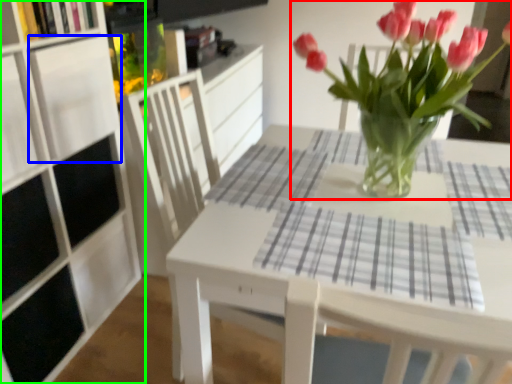
Question: Which object is positioned farthest from houseplant (highlighted by a red box)? Select from shelf (highlighted by a blue box) and cabinetry (highlighted by a green box).

Choices:
 (A) shelf
 (B) cabinetry

Answer: (B)